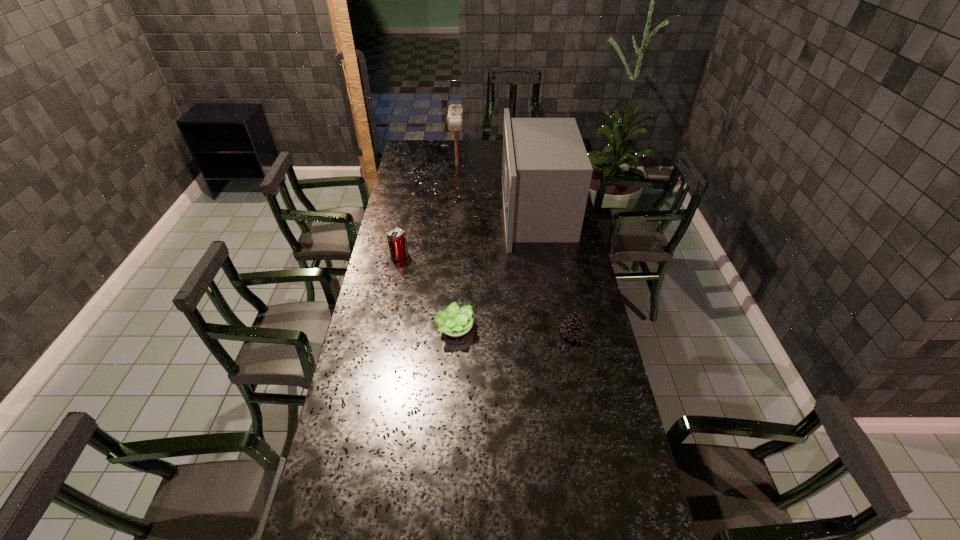
The height and width of the screenshot is (540, 960). I want to click on blank area at the far edge, so click(442, 150).

This screenshot has width=960, height=540. In order to click on blank space at the left edge of the desktop in this screenshot , I will do `click(373, 421)`.

In the image, there is a desktop. At what (x,y) coordinates should I click in order to perform the action: click on free space at the right edge. Please return your answer as a coordinate pair (x, y). Image resolution: width=960 pixels, height=540 pixels. Looking at the image, I should click on (598, 369).

The height and width of the screenshot is (540, 960). I want to click on vacant area that lies between the leftmost object and the second shortest object, so [486, 295].

This screenshot has width=960, height=540. What are the coordinates of `free space between the mallet and the pinecone` in the screenshot? It's located at (515, 249).

Where is `vacant space that is in between the fourth shortest object and the fourth tallest object`? This screenshot has height=540, width=960. vacant space that is in between the fourth shortest object and the fourth tallest object is located at coordinates (515, 249).

Locate an element on the screen. vacant area that lies between the leftmost object and the second tallest object is located at coordinates (428, 211).

Identify the location of empty space between the second shortest object and the farthest object. pos(515,249).

At what (x,y) coordinates should I click in order to perform the action: click on free area in between the second shortest object and the third tallest object. Please return your answer as a coordinate pair (x, y). Image resolution: width=960 pixels, height=540 pixels. Looking at the image, I should click on (486, 295).

At what (x,y) coordinates should I click in order to perform the action: click on vacant region between the tallest object and the second shortest object. Please return your answer as a coordinate pair (x, y). The width and height of the screenshot is (960, 540). Looking at the image, I should click on (555, 273).